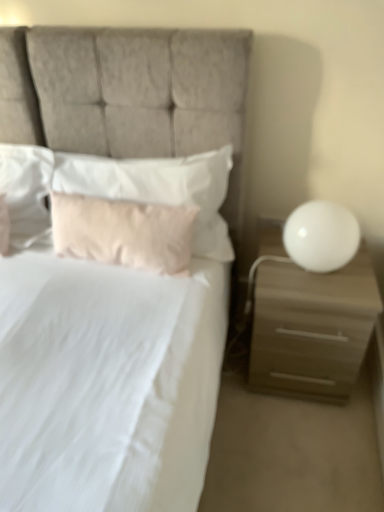
What are the coordinates of `vacant space underneath white glossy sphere at right (from a real-world perspective)` in the screenshot? It's located at (313, 272).